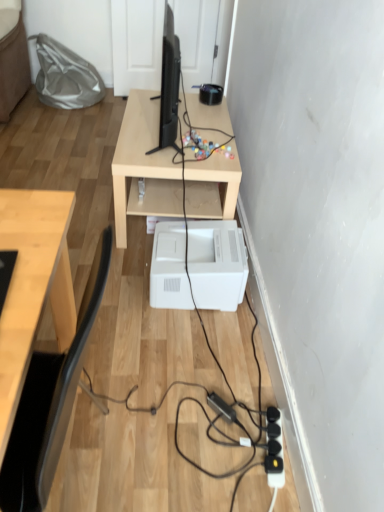
The width and height of the screenshot is (384, 512). Describe the element at coordinates (274, 450) in the screenshot. I see `black plastic extension cord at lower right` at that location.

The width and height of the screenshot is (384, 512). What are the coordinates of `black plastic extension cord at lower right` in the screenshot? It's located at (274, 450).

From the picture: Is black matte desktop computer at center shorter than black plastic extension cord at lower right?

Incorrect, the height of black matte desktop computer at center does not fall short of that of black plastic extension cord at lower right.

Which point is more distant from viewer, (164,80) or (273,471)?

The point (164,80) is farther.

Considering the relative positions of black matte desktop computer at center and black plastic extension cord at lower right in the image provided, is black matte desktop computer at center to the left of black plastic extension cord at lower right from the viewer's perspective?

Indeed, black matte desktop computer at center is positioned on the left side of black plastic extension cord at lower right.

Considering the relative sizes of black matte desktop computer at center and black plastic extension cord at lower right in the image provided, is black matte desktop computer at center thinner than black plastic extension cord at lower right?

No.

Which object is positioned more to the right, white plastic printer at lower center or black plastic extension cord at lower right?

black plastic extension cord at lower right is more to the right.

Are white plastic printer at lower center and black plastic extension cord at lower right far apart?

They are positioned close to each other.

From the picture: From a real-world perspective, is white plastic printer at lower center positioned above or below black plastic extension cord at lower right?

white plastic printer at lower center is situated higher than black plastic extension cord at lower right in the real world.

How different are the orientations of white plastic printer at lower center and black matte desktop computer at center in degrees?

white plastic printer at lower center and black matte desktop computer at center are facing 2.61 degrees away from each other.

Considering their positions, is white plastic printer at lower center located in front of or behind black matte desktop computer at center?

Visually, white plastic printer at lower center is located behind black matte desktop computer at center.

Is white plastic printer at lower center taller or shorter than black matte desktop computer at center?

Considering their sizes, white plastic printer at lower center has less height than black matte desktop computer at center.

From a real-world perspective, between black matte desktop computer at center and light wood table at center, who is vertically higher?

In real-world perspective, black matte desktop computer at center is above.

Looking at the image, does black matte desktop computer at center seem bigger or smaller compared to light wood table at center?

black matte desktop computer at center is smaller than light wood table at center.

Considering the positions of objects black matte desktop computer at center and light wood table at center in the image provided, who is more to the left, black matte desktop computer at center or light wood table at center?

black matte desktop computer at center.

In the image, is light wood table at center positioned in front of or behind black matte desktop computer at center?

Clearly, light wood table at center is behind black matte desktop computer at center.

Is light wood table at center touching black matte desktop computer at center?

No, light wood table at center is not in contact with black matte desktop computer at center.

Between point (129, 148) and point (172, 97), which one is positioned behind?

The point (172, 97) is farther.

Can you confirm if light wood table at center is taller than white plastic printer at lower center?

Correct, light wood table at center is much taller as white plastic printer at lower center.

Can you tell me how much light wood table at center and white plastic printer at lower center differ in facing direction?

1.34 degrees.

Could white plastic printer at lower center be considered to be inside light wood table at center?

No, white plastic printer at lower center is not inside light wood table at center.

Considering the relative sizes of black plastic extension cord at lower right and black matte desktop computer at center in the image provided, is black plastic extension cord at lower right wider than black matte desktop computer at center?

No, black plastic extension cord at lower right is not wider than black matte desktop computer at center.

Is black plastic extension cord at lower right not near black matte desktop computer at center?

Yes, black plastic extension cord at lower right and black matte desktop computer at center are located far from each other.

From a real-world perspective, between black plastic extension cord at lower right and black matte desktop computer at center, who is vertically lower?

black plastic extension cord at lower right.

Can you confirm if black plastic extension cord at lower right is positioned to the left of black matte desktop computer at center?

No, black plastic extension cord at lower right is not to the left of black matte desktop computer at center.

Identify the location of extension cord below the black matte desktop computer at center (from a real-world perspective). (274, 450).

At what (x,y) coordinates should I click in order to perform the action: click on printer that is on the left side of black plastic extension cord at lower right. Please return your answer as a coordinate pair (x, y). Looking at the image, I should click on (217, 264).

From the image, which object appears to be farther from black plastic extension cord at lower right, white plastic printer at lower center or black matte desktop computer at center?

black matte desktop computer at center is positioned further to the anchor black plastic extension cord at lower right.

Looking at the image, which one is located closer to black plastic extension cord at lower right, light wood table at center or black matte desktop computer at center?

Based on the image, light wood table at center appears to be nearer to black plastic extension cord at lower right.

Estimate the real-world distances between objects in this image. Which object is further from black plastic extension cord at lower right, white plastic printer at lower center or light wood table at center?

light wood table at center is further to black plastic extension cord at lower right.

Considering their positions, is light wood table at center positioned closer to black matte desktop computer at center than black plastic extension cord at lower right?

light wood table at center is positioned closer to the anchor black matte desktop computer at center.

Which object lies nearer to the anchor point white plastic printer at lower center, black matte desktop computer at center or black plastic extension cord at lower right?

Among the two, black matte desktop computer at center is located nearer to white plastic printer at lower center.

Based on their spatial positions, is light wood table at center or white plastic printer at lower center further from black matte desktop computer at center?

white plastic printer at lower center.

When comparing their distances from white plastic printer at lower center, does black plastic extension cord at lower right or black matte desktop computer at center seem further?

black plastic extension cord at lower right lies further to white plastic printer at lower center than the other object.

Considering their positions, is white plastic printer at lower center positioned further to black matte desktop computer at center than black plastic extension cord at lower right?

black plastic extension cord at lower right lies further to black matte desktop computer at center than the other object.

Where is `table between black matte desktop computer at center and black plastic extension cord at lower right vertically`? Image resolution: width=384 pixels, height=512 pixels. table between black matte desktop computer at center and black plastic extension cord at lower right vertically is located at coordinates (143, 167).

Where is `printer between light wood table at center and black plastic extension cord at lower right in the up-down direction`? printer between light wood table at center and black plastic extension cord at lower right in the up-down direction is located at coordinates (217, 264).

At what (x,y) coordinates should I click in order to perform the action: click on table that lies between black matte desktop computer at center and white plastic printer at lower center from top to bottom. Please return your answer as a coordinate pair (x, y). This screenshot has width=384, height=512. Looking at the image, I should click on (143, 167).

In order to click on printer between black matte desktop computer at center and black plastic extension cord at lower right vertically in this screenshot , I will do `click(217, 264)`.